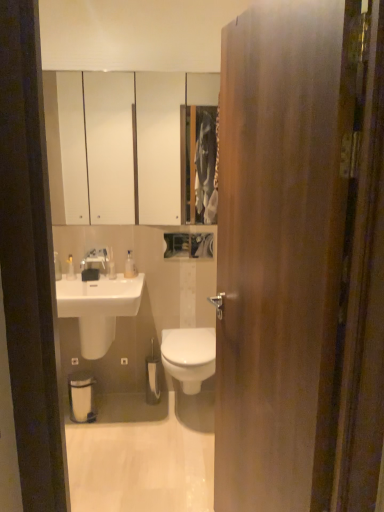
Question: Can you confirm if white glossy floor at center is bigger than satin nickel faucet at upper center?

Choices:
 (A) yes
 (B) no

Answer: (A)

Question: From the image's perspective, does white glossy floor at center appear higher than satin nickel faucet at upper center?

Choices:
 (A) yes
 (B) no

Answer: (B)

Question: Can you confirm if white glossy floor at center is shorter than satin nickel faucet at upper center?

Choices:
 (A) no
 (B) yes

Answer: (B)

Question: From a real-world perspective, is white glossy floor at center physically below satin nickel faucet at upper center?

Choices:
 (A) no
 (B) yes

Answer: (B)

Question: Can you confirm if white glossy floor at center is smaller than satin nickel faucet at upper center?

Choices:
 (A) no
 (B) yes

Answer: (A)

Question: In terms of height, does white matte toilet paper at center look taller or shorter compared to translucent plastic bottles at left, the 1th toiletry in the left-to-right sequence?

Choices:
 (A) tall
 (B) short

Answer: (A)

Question: From a real-world perspective, is white matte toilet paper at center positioned above or below translucent plastic bottles at left, the 2th toiletry from the right?

Choices:
 (A) below
 (B) above

Answer: (A)

Question: Is point (145, 359) closer or farther from the camera than point (67, 266)?

Choices:
 (A) farther
 (B) closer

Answer: (A)

Question: Considering the relative positions of white matte toilet paper at center and translucent plastic bottles at left, the 1th toiletry in the left-to-right sequence, in the image provided, is white matte toilet paper at center to the left or to the right of translucent plastic bottles at left, the 1th toiletry in the left-to-right sequence,?

Choices:
 (A) right
 (B) left

Answer: (A)

Question: Is translucent plastic bottles at left, the 1th toiletry in the left-to-right sequence, to the left or to the right of white glossy sink at lower left in the image?

Choices:
 (A) left
 (B) right

Answer: (A)

Question: Is translucent plastic bottles at left, the 1th toiletry in the left-to-right sequence, situated inside white glossy sink at lower left or outside?

Choices:
 (A) outside
 (B) inside

Answer: (A)

Question: In the image, is translucent plastic bottles at left, the 1th toiletry in the left-to-right sequence, positioned in front of or behind white glossy sink at lower left?

Choices:
 (A) front
 (B) behind

Answer: (B)

Question: Based on their sizes in the image, would you say translucent plastic bottles at left, the 1th toiletry in the left-to-right sequence, is bigger or smaller than white glossy sink at lower left?

Choices:
 (A) small
 (B) big

Answer: (A)

Question: From their relative heights in the image, would you say satin nickel faucet at upper center is taller or shorter than translucent plastic bottles at left, the 2th toiletry from the right?

Choices:
 (A) short
 (B) tall

Answer: (A)

Question: From a real-world perspective, is satin nickel faucet at upper center positioned above or below translucent plastic bottles at left, the 2th toiletry from the right?

Choices:
 (A) above
 (B) below

Answer: (A)